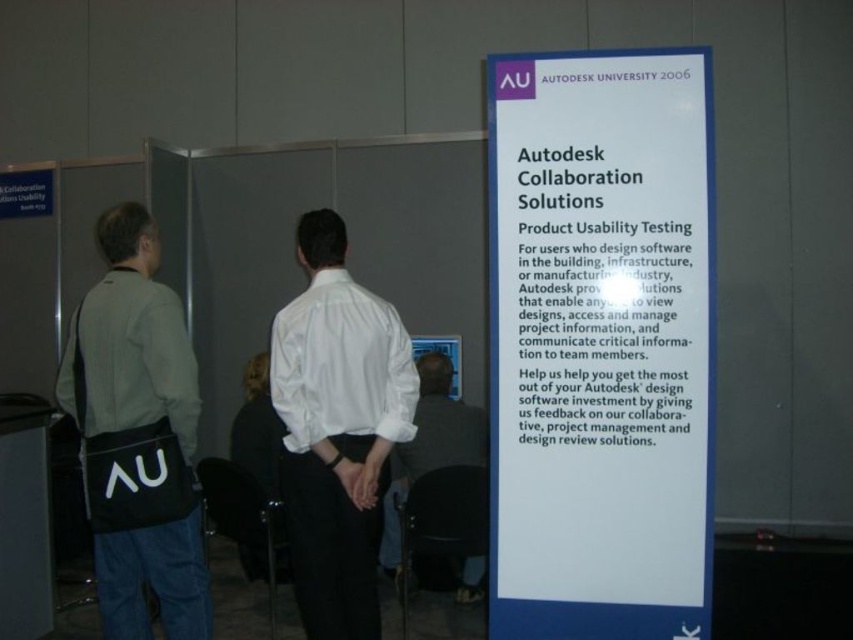
You are attending Autodesk University 2006 and need to locate the Collaboration Solutions booth. You see a black fabric bag at left and a white shirt at center. According to the scene, which object is closer to the right side of the frame?

The white shirt at center is closer to the right side of the frame because the black fabric bag at left is positioned to its left.

You are at Autodesk University 2006 and notice two people wearing white shirts in the center of the scene. Which person is wearing the white cotton shirt at center located to the left of the other white shirt at center?

The white cotton shirt at center is positioned on the left side of the white shirt at center, so the person wearing the white cotton shirt at center is the one on the left.

You are attending Autodesk University 2006 and notice a black fabric bag at left and a white cotton shirt at center. Which object is taller?

The black fabric bag at left is taller than the white cotton shirt at center.